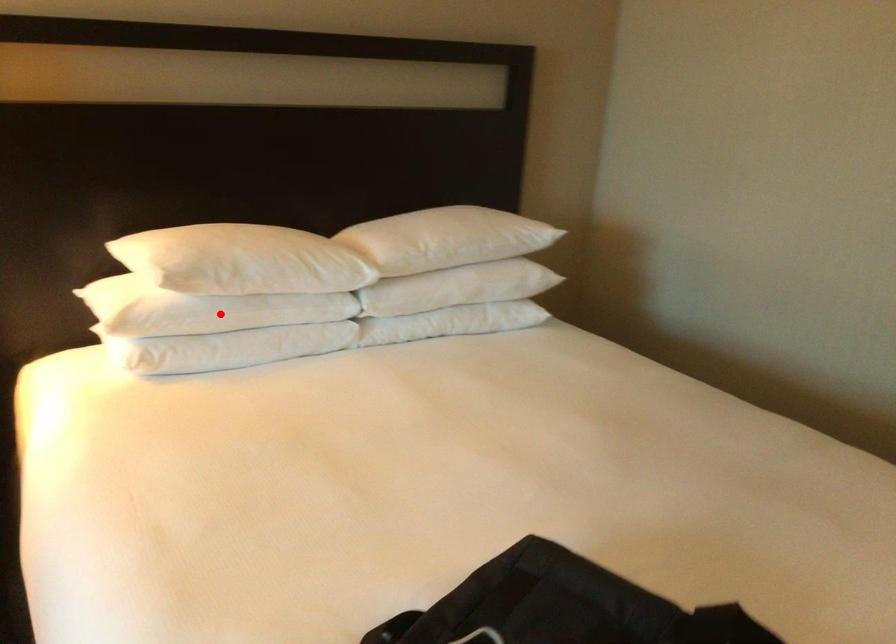
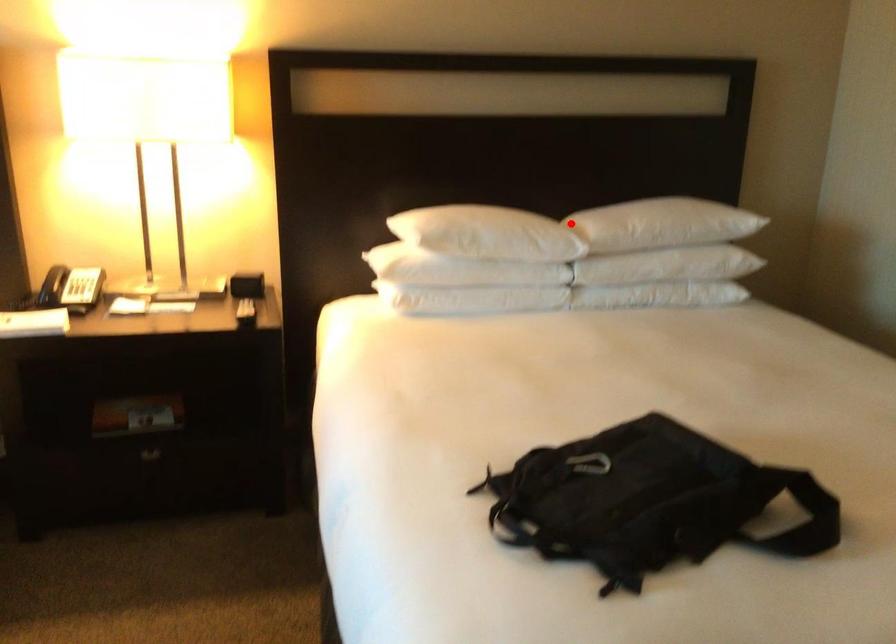
I am providing you with two images of the same scene from different viewpoints. A red point is marked on the first image and another point is marked on the second image. Do the highlighted points in image1 and image2 indicate the same real-world spot?

No